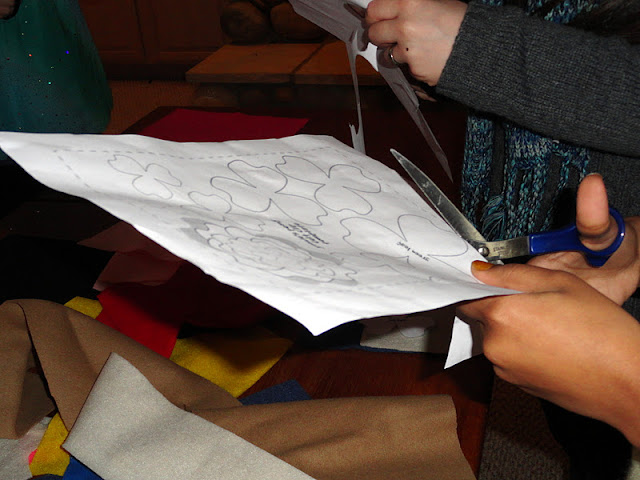
This screenshot has height=480, width=640. I want to click on brown fabric, so click(x=283, y=422).